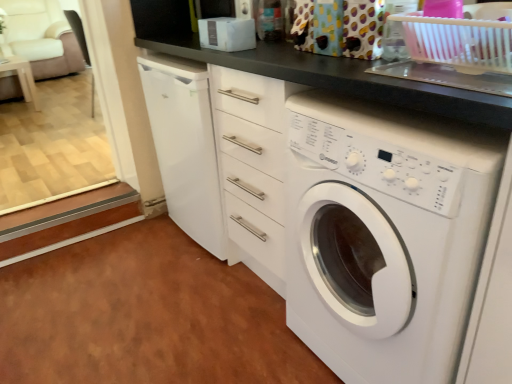
Describe the element at coordinates (385, 235) in the screenshot. I see `white glossy washing machine at center` at that location.

At what (x,y) coordinates should I click in order to perform the action: click on white glossy table at left. Please return your answer as a coordinate pair (x, y). Looking at the image, I should click on (23, 78).

I want to click on white fabric armchair at upper left, so click(42, 37).

Is white fabric armchair at upper left turned away from white glossy washing machine at center?

No, white fabric armchair at upper left is not facing the opposite direction of white glossy washing machine at center.

From the image's perspective, does white fabric armchair at upper left appear lower than white glossy washing machine at center?

No, from the image's perspective, white fabric armchair at upper left is not below white glossy washing machine at center.

Which object is wider, white fabric armchair at upper left or white glossy washing machine at center?

white fabric armchair at upper left.

Can you tell me how much white glossy washing machine at center and pink plastic basket at upper right differ in facing direction?

The facing directions of white glossy washing machine at center and pink plastic basket at upper right are 0.122 degrees apart.

Can pink plastic basket at upper right be found inside white glossy washing machine at center?

No, pink plastic basket at upper right is not inside white glossy washing machine at center.

From their relative heights in the image, would you say white glossy washing machine at center is taller or shorter than pink plastic basket at upper right?

Considering their sizes, white glossy washing machine at center has more height than pink plastic basket at upper right.

Is point (27, 94) closer or farther from the camera than point (341, 372)?

Point (27, 94) appears to be farther away from the viewer than point (341, 372).

From the image's perspective, which object appears higher, white glossy table at left or white glossy washing machine at center?

white glossy table at left is shown above in the image.

Is white glossy table at left placed right next to white glossy washing machine at center?

No, white glossy table at left is not beside white glossy washing machine at center.

From a real-world perspective, is white glossy washing machine at center beneath white glossy table at left?

No, from a real-world perspective, white glossy washing machine at center is not under white glossy table at left.

Considering the sizes of white glossy washing machine at center and white glossy table at left in the image, is white glossy washing machine at center wider or thinner than white glossy table at left?

Considering their sizes, white glossy washing machine at center looks broader than white glossy table at left.

Considering the relative positions of white glossy washing machine at center and white glossy table at left in the image provided, is white glossy washing machine at center behind white glossy table at left?

No, white glossy washing machine at center is closer to the camera.

Considering the positions of points (301, 240) and (21, 88), is point (301, 240) farther from camera compared to point (21, 88)?

No.

How many degrees apart are the facing directions of white glossy washing machine at center and white fabric armchair at upper left?

They differ by 88.4 degrees in their facing directions.

Between white glossy washing machine at center and white fabric armchair at upper left, which one has larger width?

white fabric armchair at upper left.

Is white glossy washing machine at center shorter than white fabric armchair at upper left?

No.

From the image's perspective, relative to white fabric armchair at upper left, is white glossy washing machine at center above or below?

Based on their image positions, white glossy washing machine at center is located beneath white fabric armchair at upper left.

Considering the sizes of objects white glossy table at left and pink plastic basket at upper right in the image provided, who is smaller, white glossy table at left or pink plastic basket at upper right?

pink plastic basket at upper right is smaller.

You are a GUI agent. You are given a task and a screenshot of the screen. Output one action in this format:
    pyautogui.click(x=<x>, y=<y>)
    Task: Click on the table on the left of pink plastic basket at upper right
    This screenshot has width=512, height=384.
    Given the screenshot: What is the action you would take?
    pyautogui.click(x=23, y=78)

Looking at this image, from a real-world perspective, between white glossy table at left and pink plastic basket at upper right, who is vertically lower?

In real-world perspective, white glossy table at left is lower.

Does point (462, 54) lie in front of point (21, 46)?

Yes, it is.

In the image, is pink plastic basket at upper right positioned in front of or behind white fabric armchair at upper left?

pink plastic basket at upper right is in front of white fabric armchair at upper left.

Can we say pink plastic basket at upper right lies outside white fabric armchair at upper left?

Absolutely, pink plastic basket at upper right is external to white fabric armchair at upper left.

Where is `washing machine that is in front of the white fabric armchair at upper left`? This screenshot has height=384, width=512. washing machine that is in front of the white fabric armchair at upper left is located at coordinates (385, 235).

What are the coordinates of `basket located above the white glossy washing machine at center (from the image's perspective)` in the screenshot? It's located at (458, 42).

From the image, which object appears to be nearer to pink plastic basket at upper right, white glossy table at left or white fabric armchair at upper left?

white glossy table at left lies closer to pink plastic basket at upper right than the other object.

From the picture: Estimate the real-world distances between objects in this image. Which object is closer to white fabric armchair at upper left, pink plastic basket at upper right or white glossy washing machine at center?

white glossy washing machine at center is closer to white fabric armchair at upper left.

Which object lies further to the anchor point white fabric armchair at upper left, pink plastic basket at upper right or white glossy table at left?

Among the two, pink plastic basket at upper right is located further to white fabric armchair at upper left.

Estimate the real-world distances between objects in this image. Which object is further from white fabric armchair at upper left, white glossy table at left or pink plastic basket at upper right?

pink plastic basket at upper right lies further to white fabric armchair at upper left than the other object.

Looking at this image, which object lies nearer to the anchor point white glossy table at left, pink plastic basket at upper right or white glossy washing machine at center?

white glossy washing machine at center lies closer to white glossy table at left than the other object.

Estimate the real-world distances between objects in this image. Which object is closer to pink plastic basket at upper right, white glossy washing machine at center or white fabric armchair at upper left?

Based on the image, white glossy washing machine at center appears to be nearer to pink plastic basket at upper right.

Which object lies further to the anchor point pink plastic basket at upper right, white fabric armchair at upper left or white glossy washing machine at center?

white fabric armchair at upper left.

Estimate the real-world distances between objects in this image. Which object is closer to white glossy table at left, pink plastic basket at upper right or white fabric armchair at upper left?

white fabric armchair at upper left is closer to white glossy table at left.

This screenshot has height=384, width=512. What are the coordinates of `basket between white glossy washing machine at center and white glossy table at left in the front-back direction` in the screenshot? It's located at (458, 42).

Locate an element on the screen. Image resolution: width=512 pixels, height=384 pixels. table positioned between white glossy washing machine at center and white fabric armchair at upper left from near to far is located at coordinates (23, 78).

The width and height of the screenshot is (512, 384). Identify the location of basket positioned between white glossy washing machine at center and white fabric armchair at upper left from near to far. (458, 42).

In order to click on table located between pink plastic basket at upper right and white fabric armchair at upper left in the depth direction in this screenshot , I will do `click(23, 78)`.